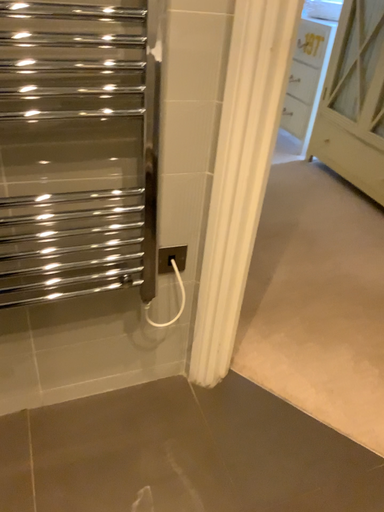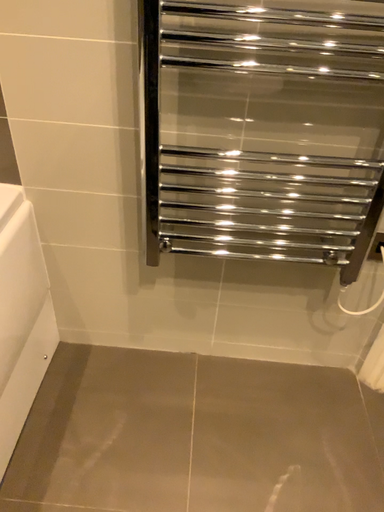
Question: Which way did the camera rotate in the video?

Choices:
 (A) rotated left
 (B) rotated right

Answer: (A)